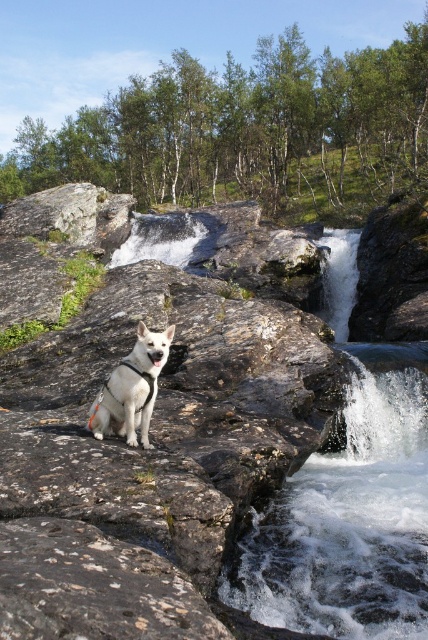
Between white stone creek at center and white matte dog at center, which one is positioned lower?

white matte dog at center is lower down.

Which of these two, white stone creek at center or white matte dog at center, stands shorter?

With less height is white matte dog at center.

The width and height of the screenshot is (428, 640). Identify the location of white stone creek at center. (157, 401).

Is white stone creek at center positioned behind white frothy water at lower right?

No, white stone creek at center is in front of white frothy water at lower right.

Which is below, white stone creek at center or white frothy water at lower right?

white frothy water at lower right is lower down.

Image resolution: width=428 pixels, height=640 pixels. What do you see at coordinates (157, 401) in the screenshot? I see `white stone creek at center` at bounding box center [157, 401].

I want to click on white stone creek at center, so click(x=157, y=401).

Between point (237, 579) and point (133, 362), which one is positioned behind?

The point (133, 362) is more distant.

Who is positioned more to the left, white frothy water at lower right or white matte dog at center?

white matte dog at center

What do you see at coordinates (348, 518) in the screenshot? The height and width of the screenshot is (640, 428). I see `white frothy water at lower right` at bounding box center [348, 518].

The height and width of the screenshot is (640, 428). I want to click on white frothy water at lower right, so click(x=348, y=518).